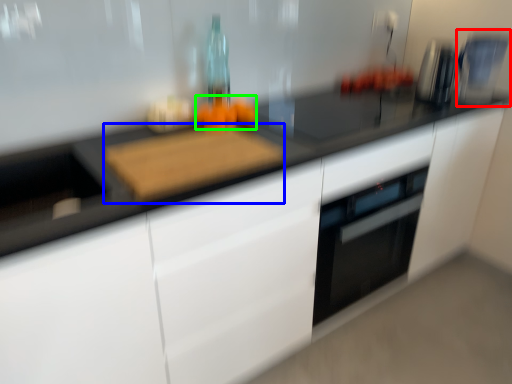
Question: Considering the real-world distances, which object is closest to coffee machine (highlighted by a red box)? cutting board (highlighted by a blue box) or food (highlighted by a green box).

Choices:
 (A) cutting board
 (B) food

Answer: (B)